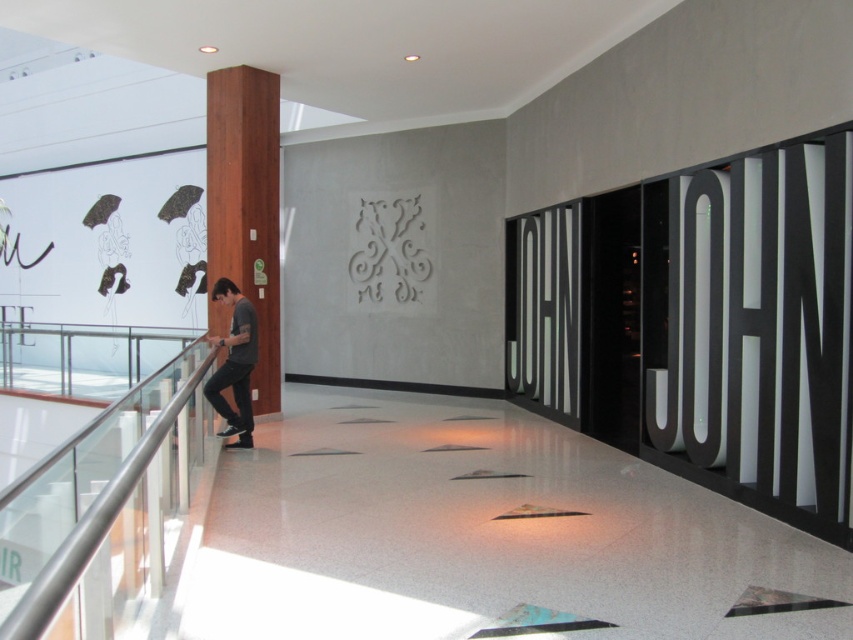
Is point (90, 426) positioned behind point (242, 317)?

That is False.

Does silver metallic railing at left have a greater width compared to dark gray t-shirt at center?

Indeed, silver metallic railing at left has a greater width compared to dark gray t-shirt at center.

This screenshot has height=640, width=853. I want to click on silver metallic railing at left, so (x=103, y=512).

Is silver metallic railing at left positioned before wooden pillar at left?

Yes, it is.

Can you confirm if silver metallic railing at left is wider than wooden pillar at left?

Yes, silver metallic railing at left is wider than wooden pillar at left.

What do you see at coordinates (103, 512) in the screenshot? I see `silver metallic railing at left` at bounding box center [103, 512].

At what (x,y) coordinates should I click in order to perform the action: click on silver metallic railing at left. Please return your answer as a coordinate pair (x, y). The height and width of the screenshot is (640, 853). Looking at the image, I should click on [103, 512].

From the picture: Is wooden pillar at left to the right of dark gray t-shirt at center from the viewer's perspective?

No, wooden pillar at left is not to the right of dark gray t-shirt at center.

Between point (276, 296) and point (219, 285), which one is positioned behind?

Point (276, 296)

Which is in front, point (239, 209) or point (236, 312)?

Point (236, 312) is more forward.

Image resolution: width=853 pixels, height=640 pixels. In order to click on wooden pillar at left in this screenshot , I will do `click(245, 209)`.